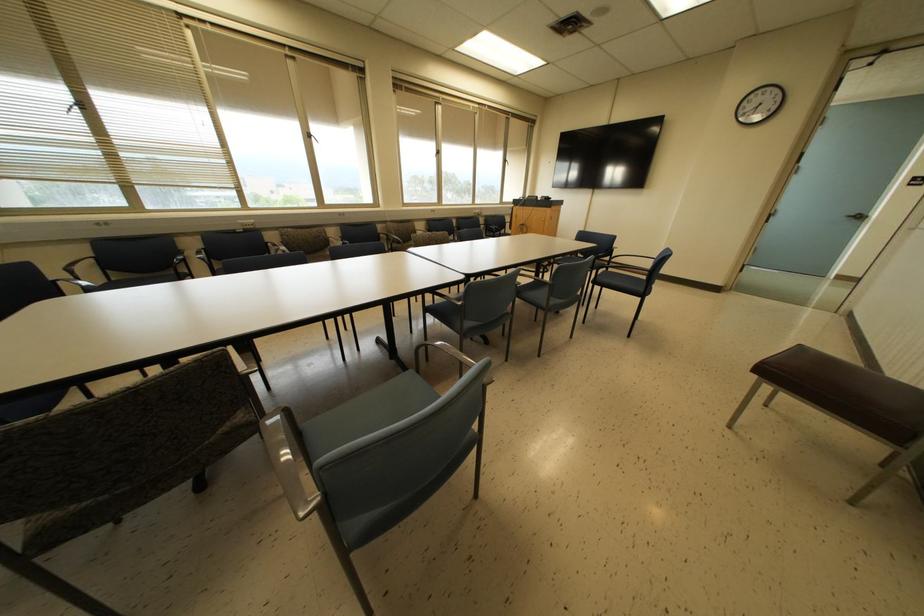
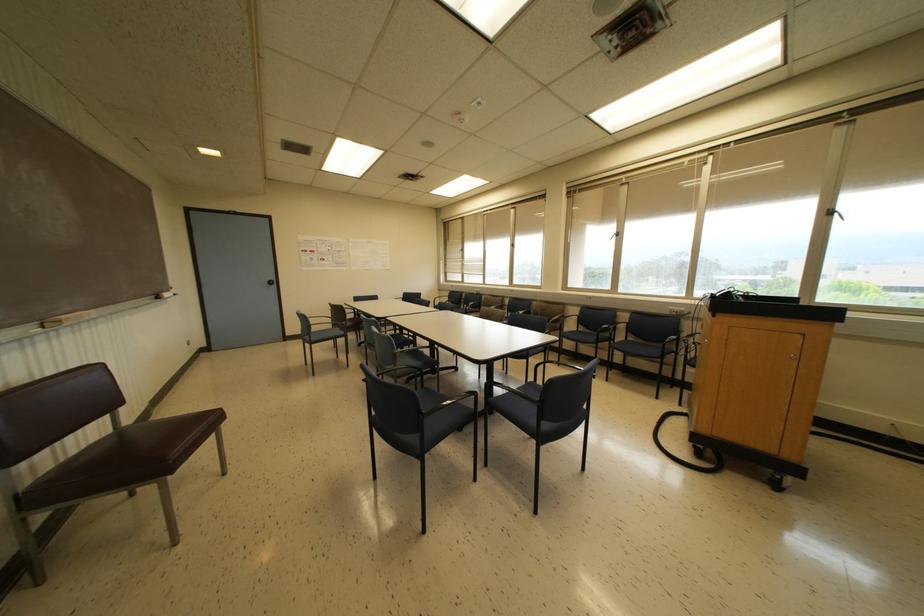
Find the pixel in the second image that matches point 504,160 in the first image.

(827, 213)